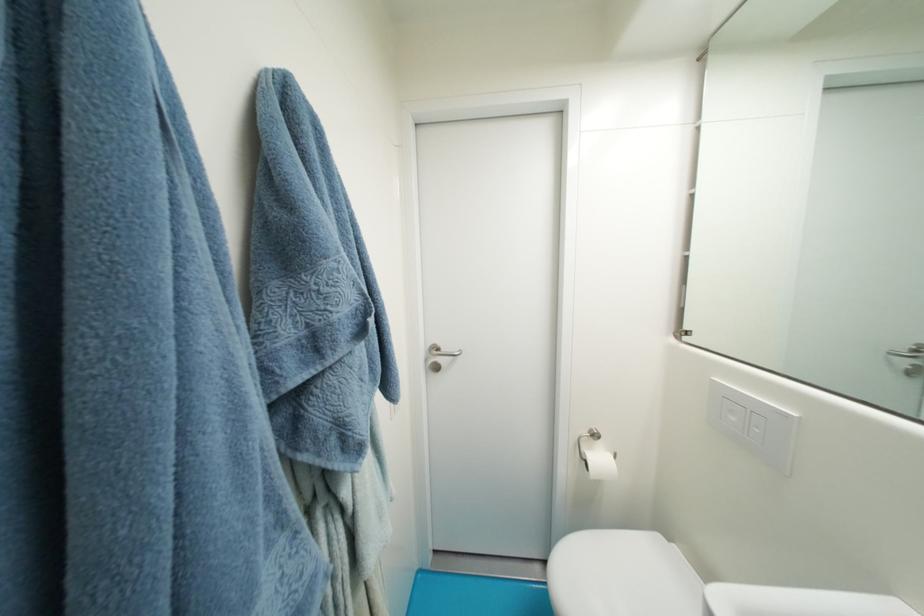
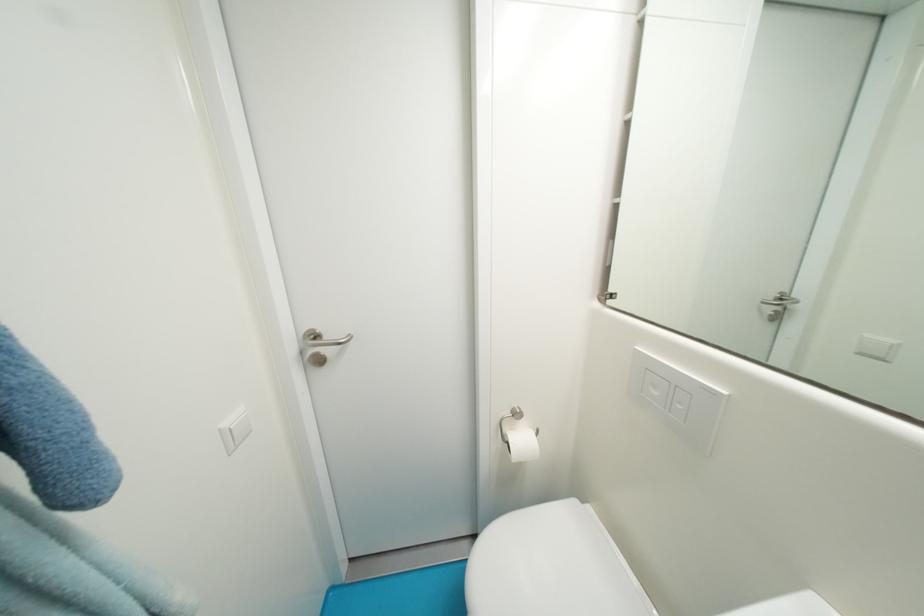
Locate, in the second image, the point that corresponds to (762,429) in the first image.

(687, 406)